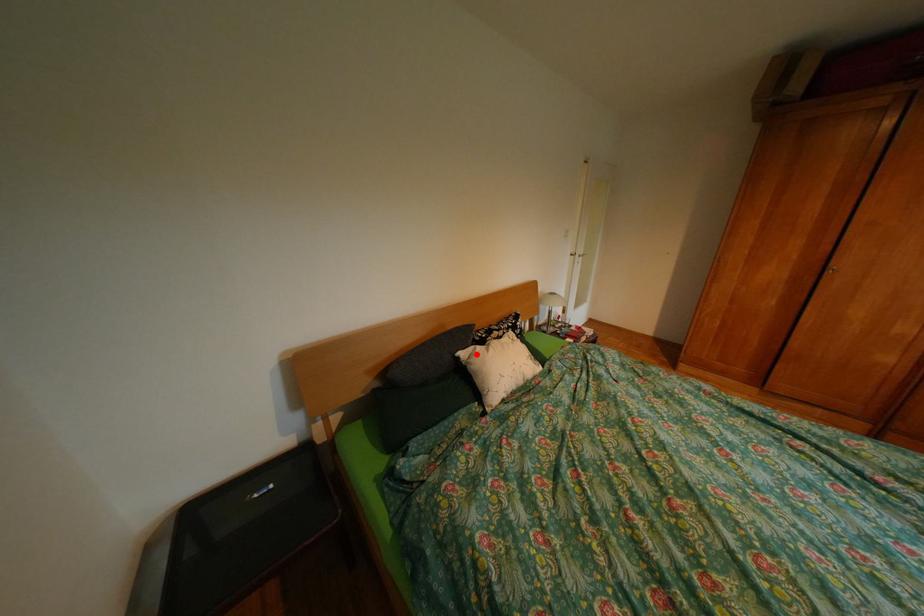
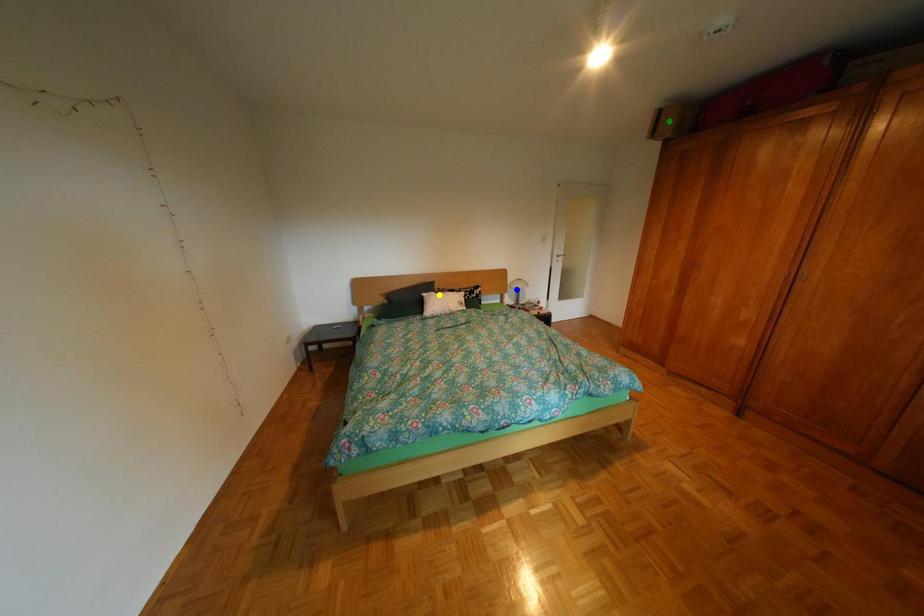
Question: I am providing you with two images of the same scene from different viewpoints. A red point is marked on the first image. You are given multiple points on the second image. Which mark in image 2 goes with the point in image 1?

Choices:
 (A) green point
 (B) blue point
 (C) yellow point

Answer: (C)